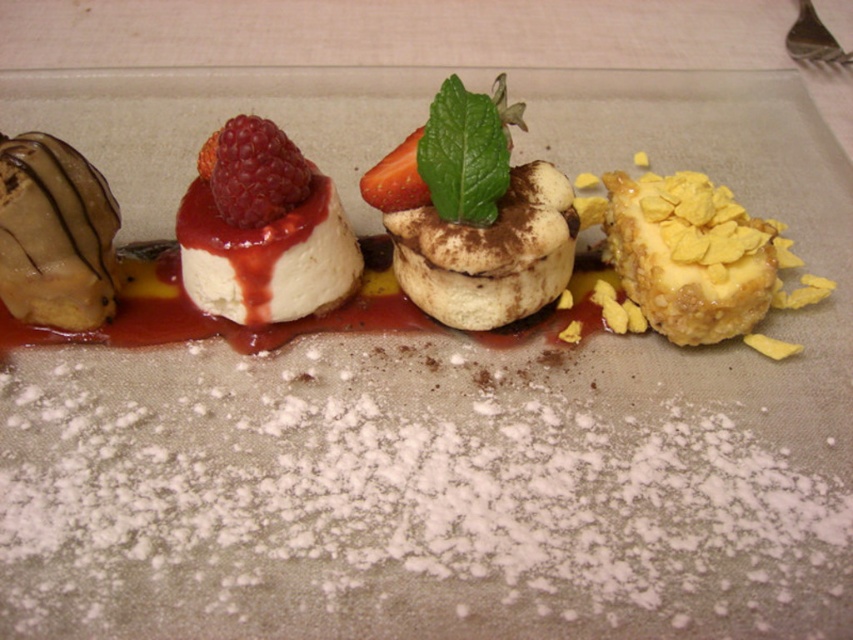
Question: Can you confirm if strawberry at center is bigger than yellow crumbly pastry at right?

Choices:
 (A) no
 (B) yes

Answer: (A)

Question: Considering the real-world distances, which object is farthest from the chocolate-dipped ice cream at left?

Choices:
 (A) cinnamon-sprinkled pastry at center
 (B) yellow crumbly pastry at right

Answer: (B)

Question: Among these objects, which one is nearest to the camera?

Choices:
 (A) chocolate-dipped ice cream at left
 (B) white creamy mousse at center
 (C) raspberry at center
 (D) cinnamon-sprinkled pastry at center

Answer: (A)

Question: Can you confirm if cinnamon-sprinkled pastry at center is positioned above raspberry at center?

Choices:
 (A) no
 (B) yes

Answer: (A)

Question: Does white creamy mousse at center appear on the left side of raspberry at center?

Choices:
 (A) yes
 (B) no

Answer: (B)

Question: Which of the following is the farthest from the observer?

Choices:
 (A) (262, 180)
 (B) (480, 288)

Answer: (B)